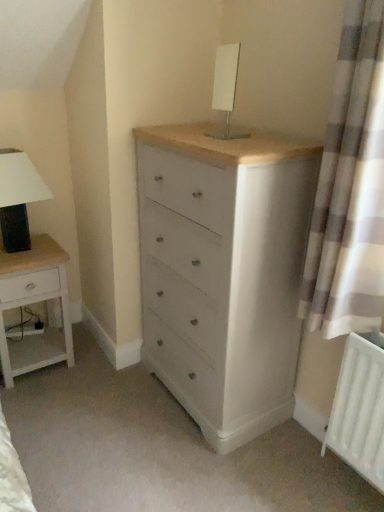
This screenshot has width=384, height=512. I want to click on vacant space situated on the left part of white matte radiator at lower right, so click(x=308, y=476).